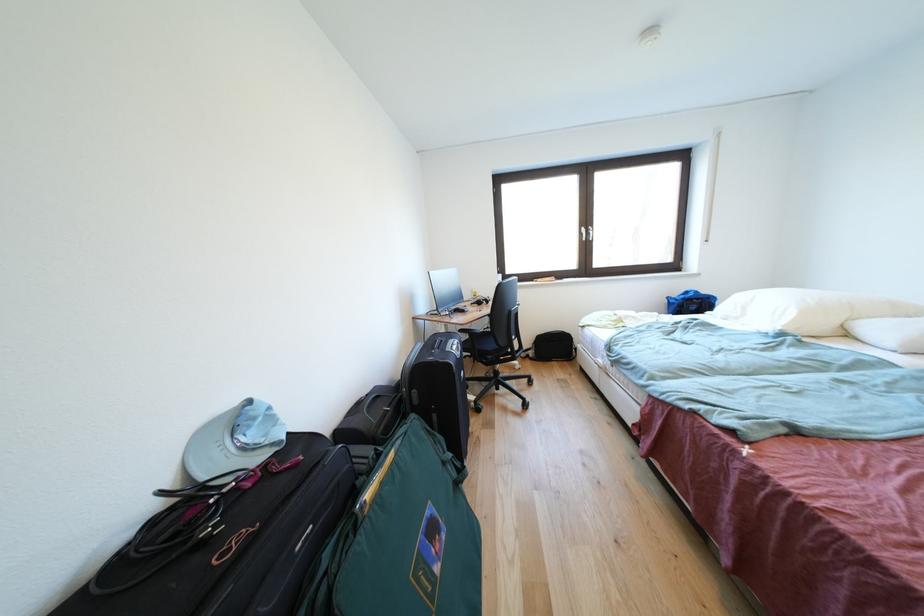
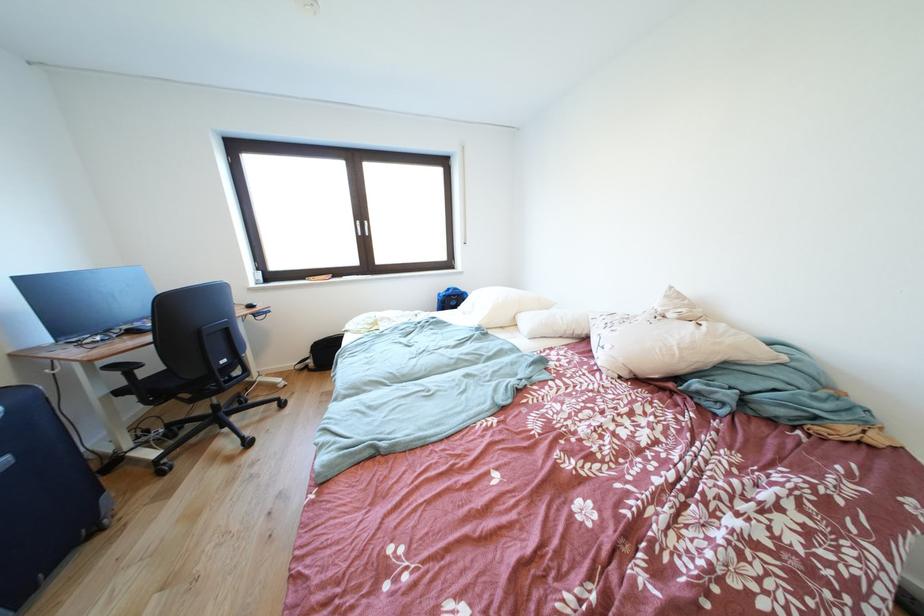
In the second image, find the point that corresponds to pixel 675 302 in the first image.

(447, 299)